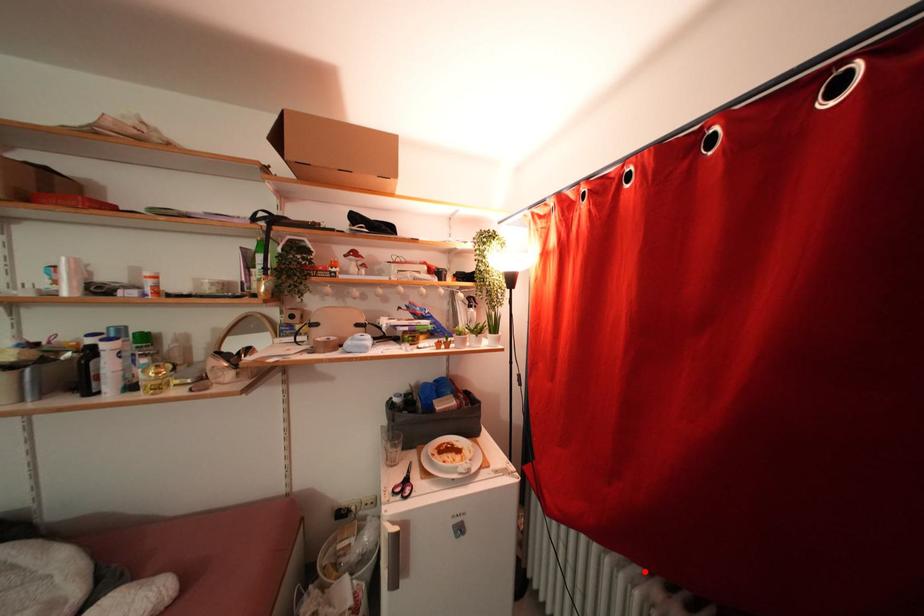
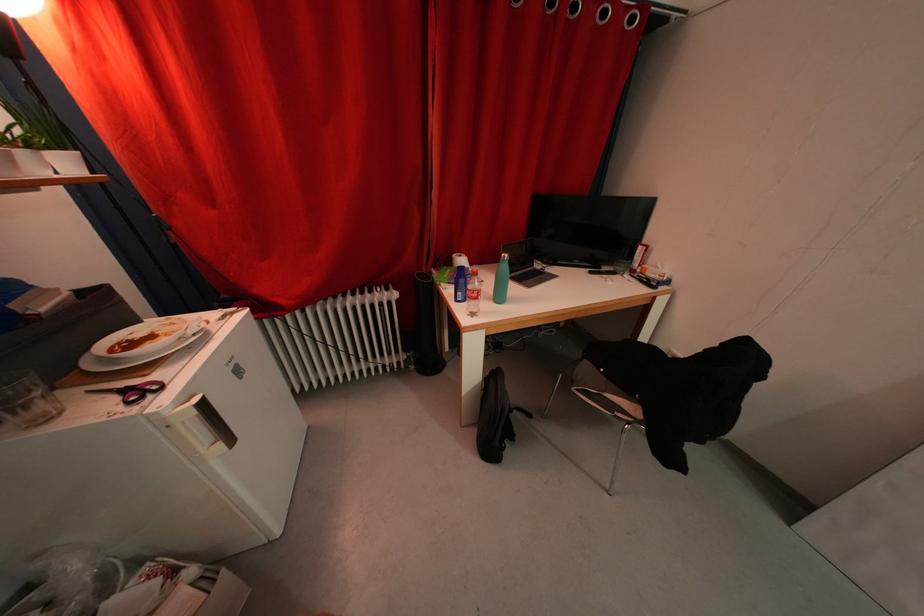
Find the pixel in the second image that matches the highlighted location in the first image.

(346, 302)